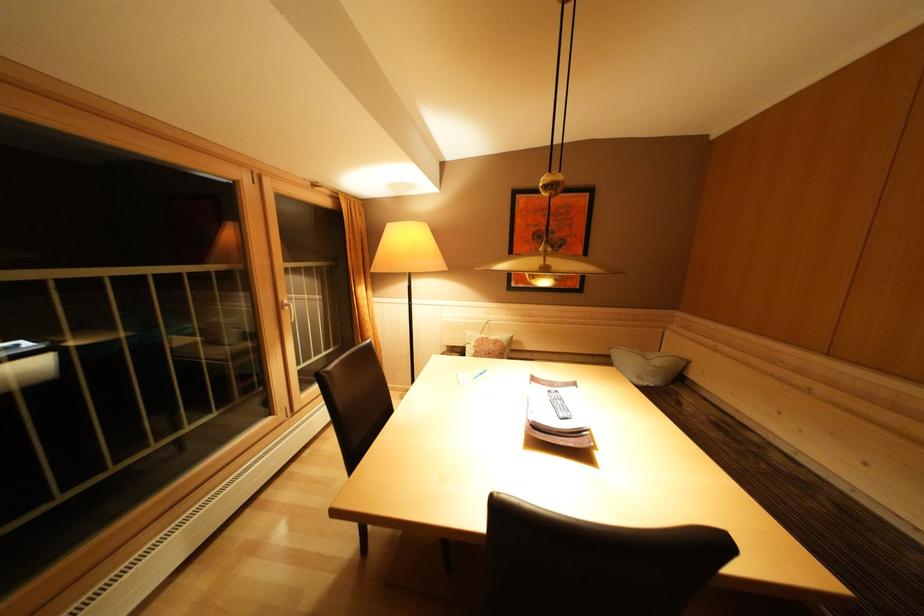
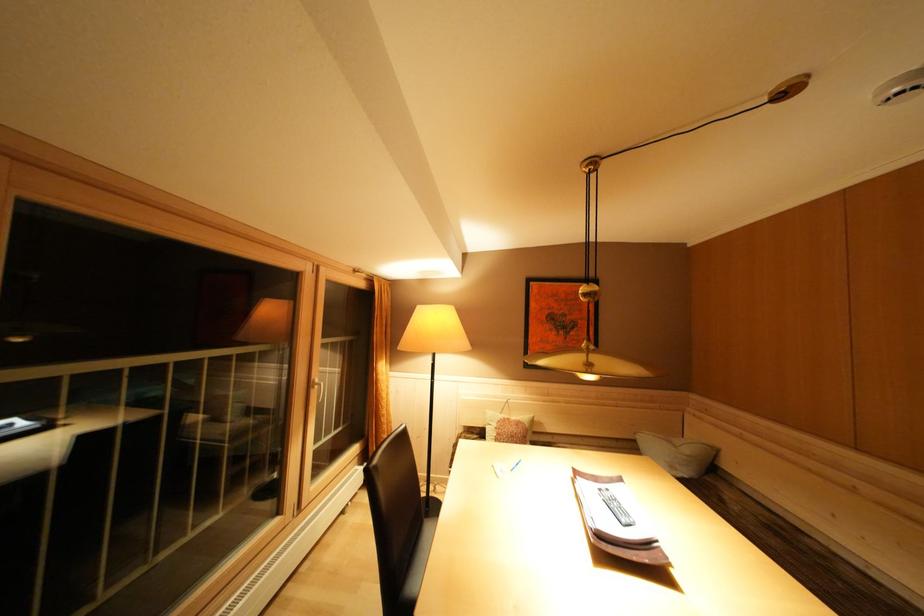
Find the pixel in the second image that matches (556,397) in the first image.

(608, 495)